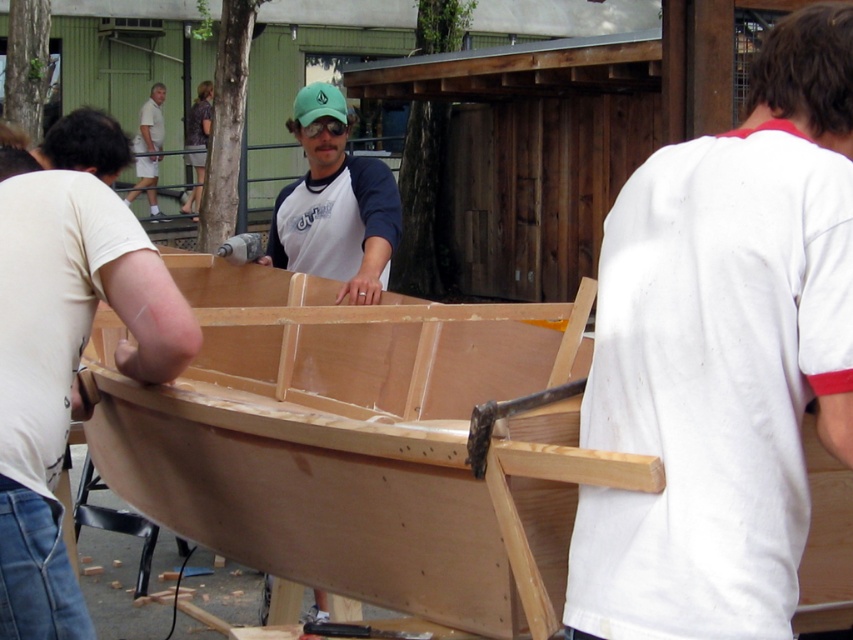
Can you confirm if matte wood boat at center is positioned below white cotton shirt at upper left?

Yes.

Is point (338, 244) behind point (141, 173)?

No, (338, 244) is in front of (141, 173).

Is point (291, 227) behind point (155, 148)?

No, it is in front of (155, 148).

Identify the location of matte wood boat at center. The width and height of the screenshot is (853, 640). (334, 204).

Is natural wood canoe at center to the right of matte wood boat at center from the viewer's perspective?

Incorrect, natural wood canoe at center is not on the right side of matte wood boat at center.

Is natural wood canoe at center further to the viewer compared to matte wood boat at center?

No, it is not.

Is point (386, 602) positioned after point (337, 266)?

No, (386, 602) is in front of (337, 266).

At what (x,y) coordinates should I click in order to perform the action: click on natural wood canoe at center. Please return your answer as a coordinate pair (x, y). Looking at the image, I should click on (363, 444).

Based on the photo, is the position of light brown wood plank at center more distant than that of matte wood boat at center?

No, it is not.

At what (x,y) coordinates should I click in order to perform the action: click on light brown wood plank at center. Please return your answer as a coordinate pair (x, y). Image resolution: width=853 pixels, height=640 pixels. Looking at the image, I should click on (67, 348).